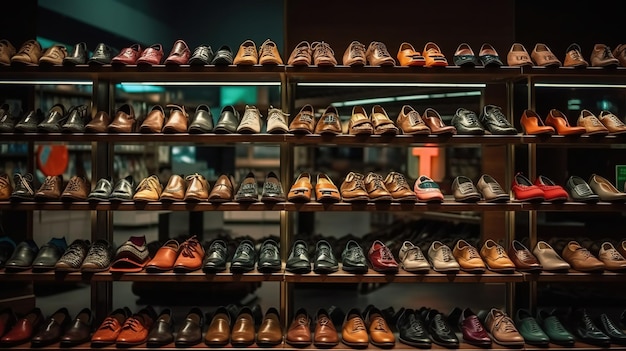
Where is `shelf`? The width and height of the screenshot is (626, 351). shelf is located at coordinates (300, 69), (297, 137), (300, 209), (312, 275), (340, 345).